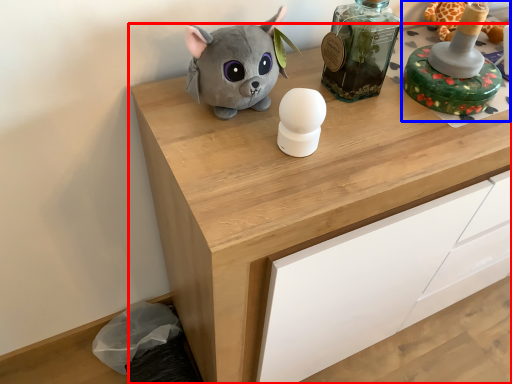
Question: Which object appears closest to the camera in this image, chest of drawers (highlighted by a red box) or toy (highlighted by a blue box)?

Choices:
 (A) chest of drawers
 (B) toy

Answer: (A)